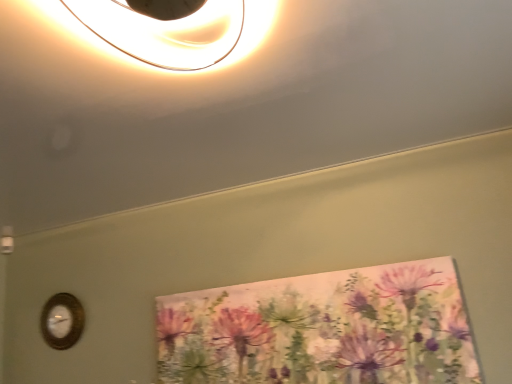
Question: Considering the relative sizes of wooden wall clock at lower left and watercolor floral painting at center in the image provided, is wooden wall clock at lower left thinner than watercolor floral painting at center?

Choices:
 (A) yes
 (B) no

Answer: (A)

Question: Is wooden wall clock at lower left shorter than watercolor floral painting at center?

Choices:
 (A) no
 (B) yes

Answer: (B)

Question: Can you confirm if wooden wall clock at lower left is positioned to the left of watercolor floral painting at center?

Choices:
 (A) yes
 (B) no

Answer: (A)

Question: Is wooden wall clock at lower left oriented towards watercolor floral painting at center?

Choices:
 (A) yes
 (B) no

Answer: (B)

Question: Does wooden wall clock at lower left have a smaller size compared to watercolor floral painting at center?

Choices:
 (A) no
 (B) yes

Answer: (B)

Question: From the image's perspective, does wooden wall clock at lower left appear higher than watercolor floral painting at center?

Choices:
 (A) yes
 (B) no

Answer: (B)

Question: From the image's perspective, is watercolor floral painting at center above wooden wall clock at lower left?

Choices:
 (A) yes
 (B) no

Answer: (A)

Question: Can you confirm if watercolor floral painting at center is smaller than wooden wall clock at lower left?

Choices:
 (A) no
 (B) yes

Answer: (A)

Question: Could you tell me if watercolor floral painting at center is facing wooden wall clock at lower left?

Choices:
 (A) yes
 (B) no

Answer: (B)

Question: Considering the relative sizes of watercolor floral painting at center and wooden wall clock at lower left in the image provided, is watercolor floral painting at center wider than wooden wall clock at lower left?

Choices:
 (A) yes
 (B) no

Answer: (A)

Question: Can you confirm if watercolor floral painting at center is positioned to the right of wooden wall clock at lower left?

Choices:
 (A) no
 (B) yes

Answer: (B)

Question: Does watercolor floral painting at center have a larger size compared to wooden wall clock at lower left?

Choices:
 (A) yes
 (B) no

Answer: (A)

Question: Is watercolor floral painting at center in front of or behind wooden wall clock at lower left in the image?

Choices:
 (A) front
 (B) behind

Answer: (A)